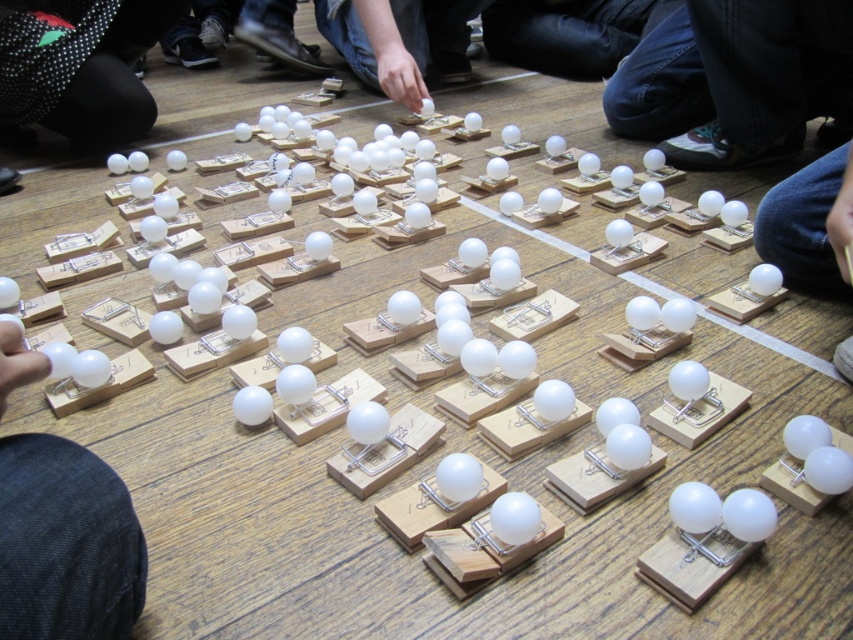
Looking at this image, you are a participant in a game where you must determine which white matte ping pong ball is closer to the floor. You see the white matte ping pong ball at lower left and the white matte ping pong ball at lower right. Which one is lower?

The white matte ping pong ball at lower left is shorter than the white matte ping pong ball at lower right, so the white matte ping pong ball at lower left is lower.

You are a participant in a game where you must determine which white matte ping pong ball is nearer to you. You see two balls labeled as the white matte ping pong ball at lower left and the white matte ping pong ball at lower right. Based on the arrangement of the mousetraps, which one is closer?

The white matte ping pong ball at lower left is closer to the viewer than the white matte ping pong ball at lower right.

You are standing at the origin point of the coordinate system in the image. You need to move towards the white matte ping pong ball at lower left. What are the coordinates you need to move to?

The coordinates to move to are 0.850 in the x direction and 0.077 in the y direction.